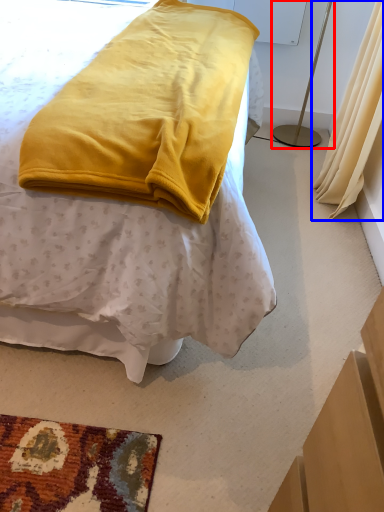
Question: Which object is further to the camera taking this photo, bedside lamp (highlighted by a red box) or curtain (highlighted by a blue box)?

Choices:
 (A) bedside lamp
 (B) curtain

Answer: (A)